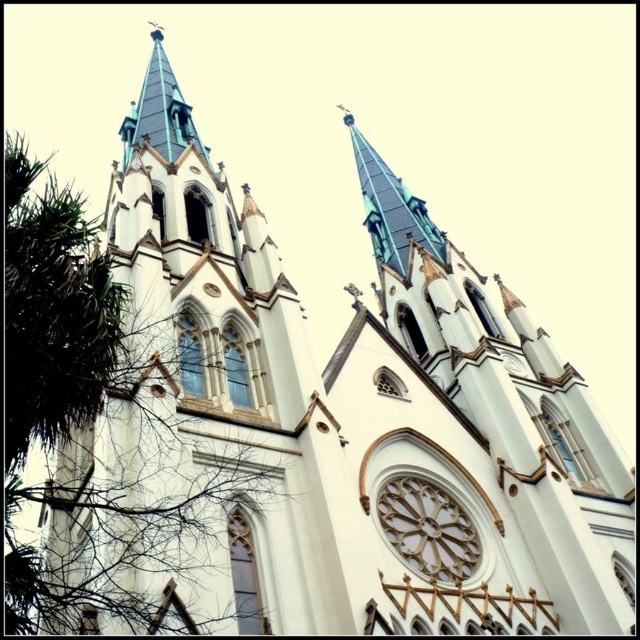
Question: Which point appears closest to the camera in this image?

Choices:
 (A) (120, 346)
 (B) (552, 460)

Answer: (A)

Question: Can you confirm if white stone tower at center is positioned above green leafy tree at left?

Choices:
 (A) no
 (B) yes

Answer: (A)

Question: Which point appears closest to the camera in this image?

Choices:
 (A) (454, 497)
 (B) (6, 493)

Answer: (B)

Question: Is white stone tower at center closer to camera compared to green leafy tree at left?

Choices:
 (A) yes
 (B) no

Answer: (B)

Question: Does white stone tower at center come behind green leafy tree at left?

Choices:
 (A) yes
 (B) no

Answer: (A)

Question: Which point appears closest to the camera in this image?

Choices:
 (A) (60, 588)
 (B) (552, 449)

Answer: (A)